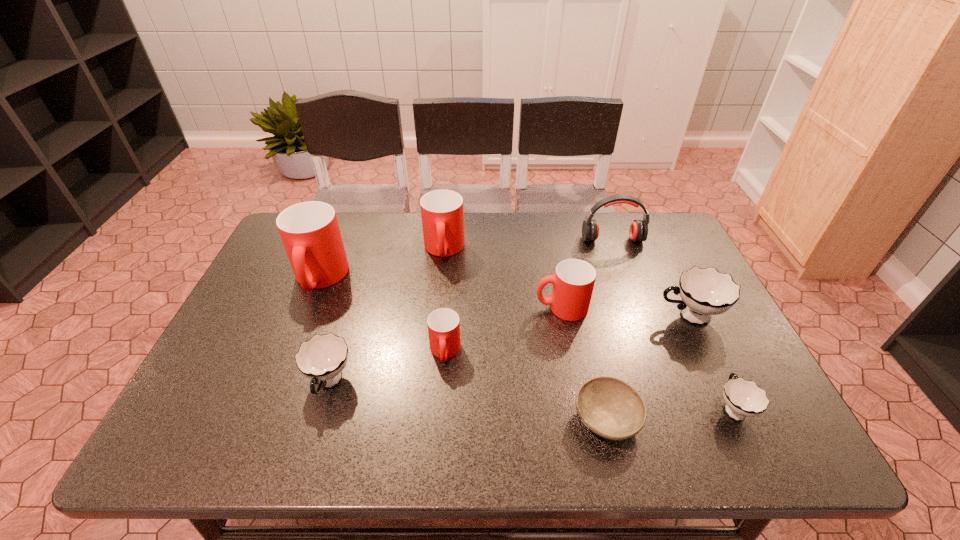
Where is `vacant point located between the sixth shortest cup and the gray bowl`? The height and width of the screenshot is (540, 960). vacant point located between the sixth shortest cup and the gray bowl is located at coordinates (525, 334).

The width and height of the screenshot is (960, 540). Find the location of `vacant space that is in between the bowl and the biggest red cup`. vacant space that is in between the bowl and the biggest red cup is located at coordinates (463, 349).

You are a GUI agent. You are given a task and a screenshot of the screen. Output one action in this format:
    pyautogui.click(x=<x>, y=<y>)
    Task: Click on the free space between the biggest red cup and the second biggest red cup
    
    Given the screenshot: What is the action you would take?
    (382, 264)

The image size is (960, 540). I want to click on free space between the smallest red cup and the second biggest red cup, so click(x=444, y=301).

The width and height of the screenshot is (960, 540). Identify the location of free point between the second shortest object and the leftmost white cup. (531, 395).

The height and width of the screenshot is (540, 960). I want to click on free space between the smallest red cup and the red earphone, so click(529, 295).

What are the coordinates of `empty location between the farthest white cup and the shortest object` in the screenshot? It's located at (648, 368).

Locate an element on the screen. empty space that is in between the nearest red cup and the leftmost white cup is located at coordinates (387, 367).

The width and height of the screenshot is (960, 540). In order to click on unoccupied position between the second shortest object and the leftmost red cup in this screenshot , I will do `click(526, 343)`.

Where is `the closest object to the smallest red cup`? The width and height of the screenshot is (960, 540). the closest object to the smallest red cup is located at coordinates (322, 358).